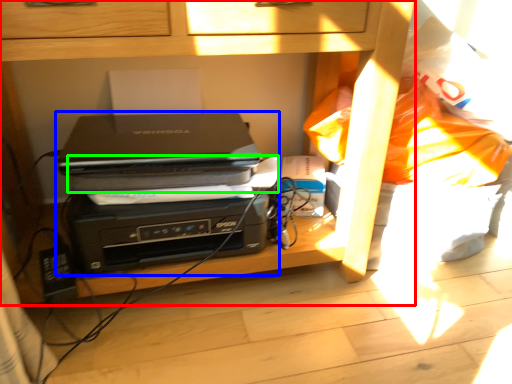
Question: Which object is the farthest from furniture (highlighted by a red box)? Choose among these: printer (highlighted by a blue box) or paperback book (highlighted by a green box).

Choices:
 (A) printer
 (B) paperback book

Answer: (B)